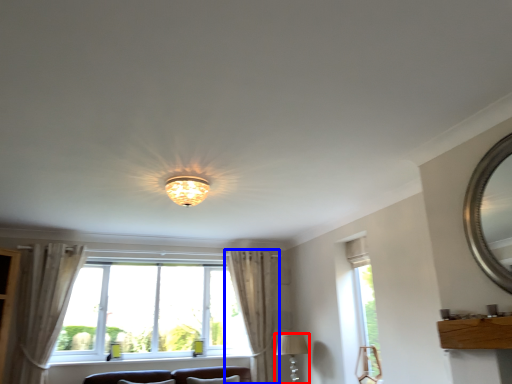
Question: Which object appears farthest to the camera in this image, lamp (highlighted by a red box) or curtain (highlighted by a blue box)?

Choices:
 (A) lamp
 (B) curtain

Answer: (B)